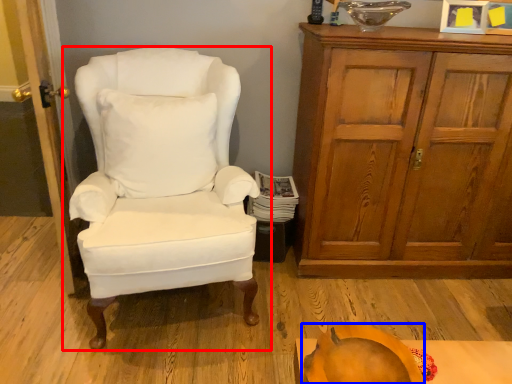
Question: Which point is further to the camera, chair (highlighted by a red box) or pumpkin (highlighted by a blue box)?

Choices:
 (A) chair
 (B) pumpkin

Answer: (A)